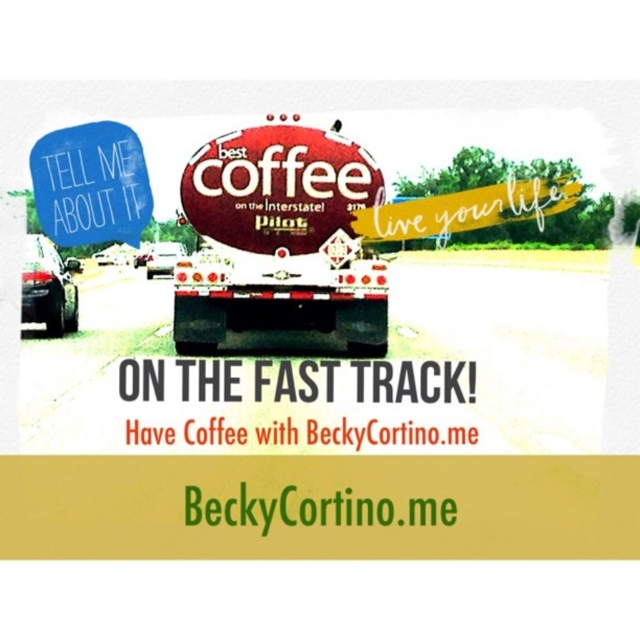
Question: Which point is closer to the camera?

Choices:
 (A) blue paper sign at upper left
 (B) white glossy trailer truck at center

Answer: (A)

Question: Considering the real-world distances, which object is farthest from the blue paper sign at upper left?

Choices:
 (A) white glossy trailer truck at center
 (B) metallic red stop sign at center

Answer: (A)

Question: Can you confirm if metallic red stop sign at center is positioned below white glossy trailer truck at center?

Choices:
 (A) no
 (B) yes

Answer: (A)

Question: In this image, where is metallic red stop sign at center located relative to blue paper sign at upper left?

Choices:
 (A) right
 (B) left

Answer: (A)

Question: Is white glossy trailer truck at center in front of blue paper sign at upper left?

Choices:
 (A) no
 (B) yes

Answer: (A)

Question: Which is farther from the blue paper sign at upper left?

Choices:
 (A) white glossy trailer truck at center
 (B) metallic red stop sign at center

Answer: (A)